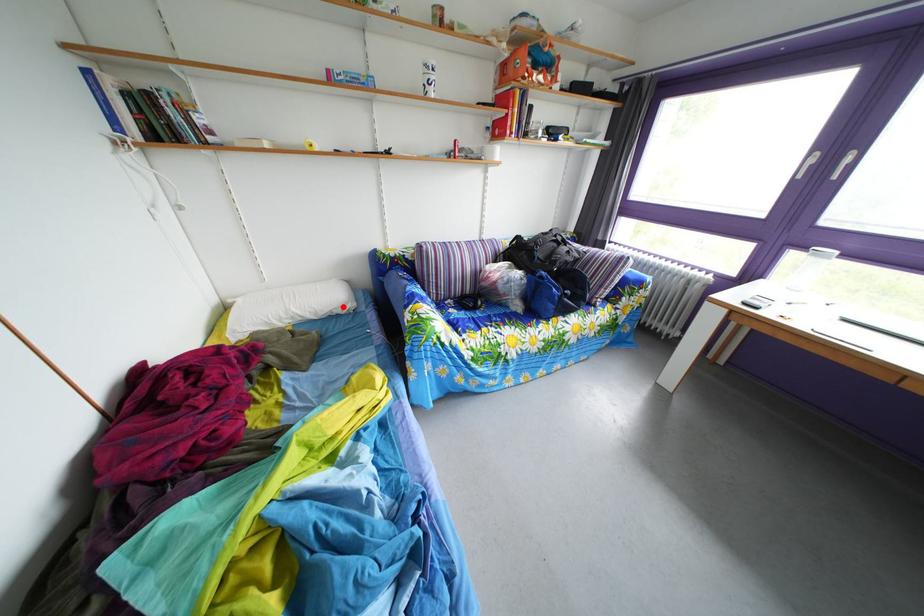
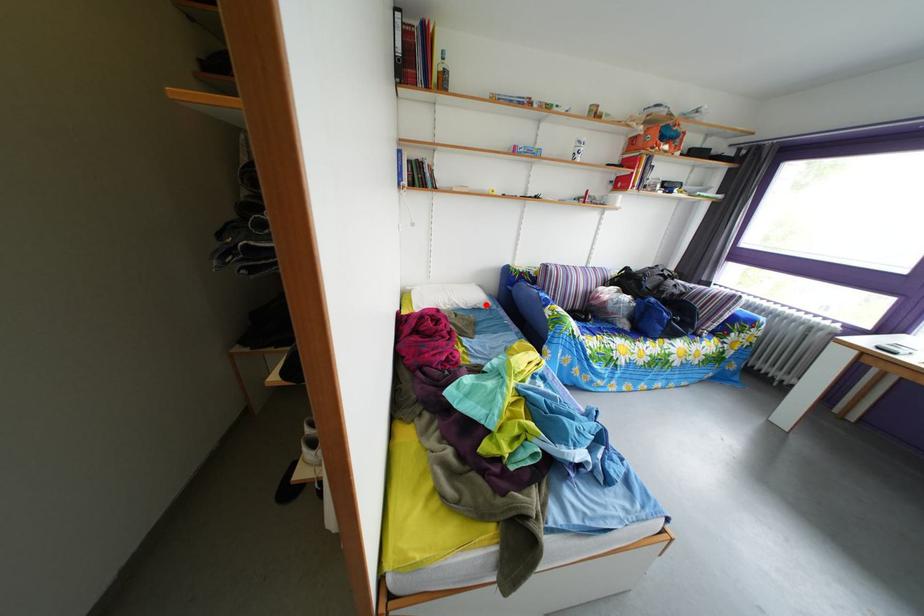
I am providing you with two images of the same scene from different viewpoints. A red point is marked on the first image and another point is marked on the second image. Does the point marked in image1 correspond to the same location as the one in image2?

Yes